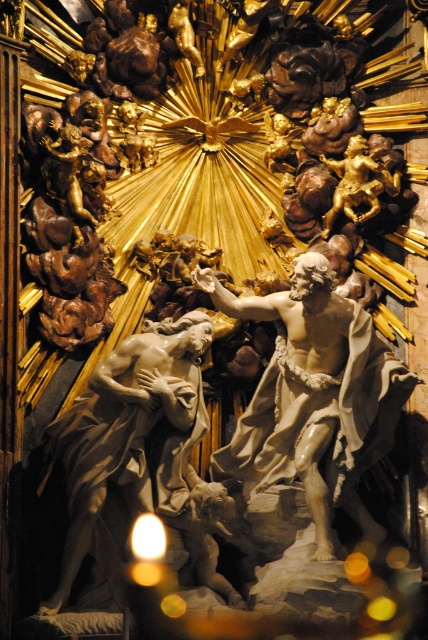
You are an art conservator examining the Baroque sculpture. You notice two statues at the center. Which statue is closer to you, the white marble statue at center or the matte white statue at center?

The white marble statue at center is closer to you because the matte white statue at center is positioned behind it.